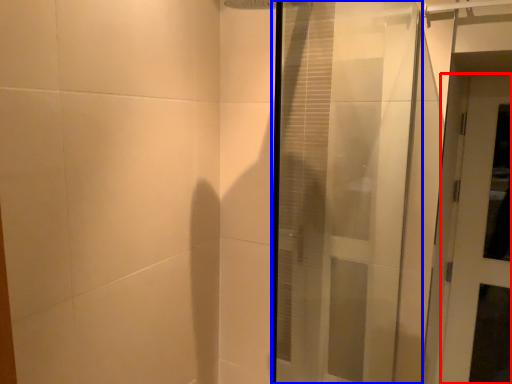
Question: Which object appears farthest to the camera in this image, door (highlighted by a red box) or door (highlighted by a blue box)?

Choices:
 (A) door
 (B) door

Answer: (A)